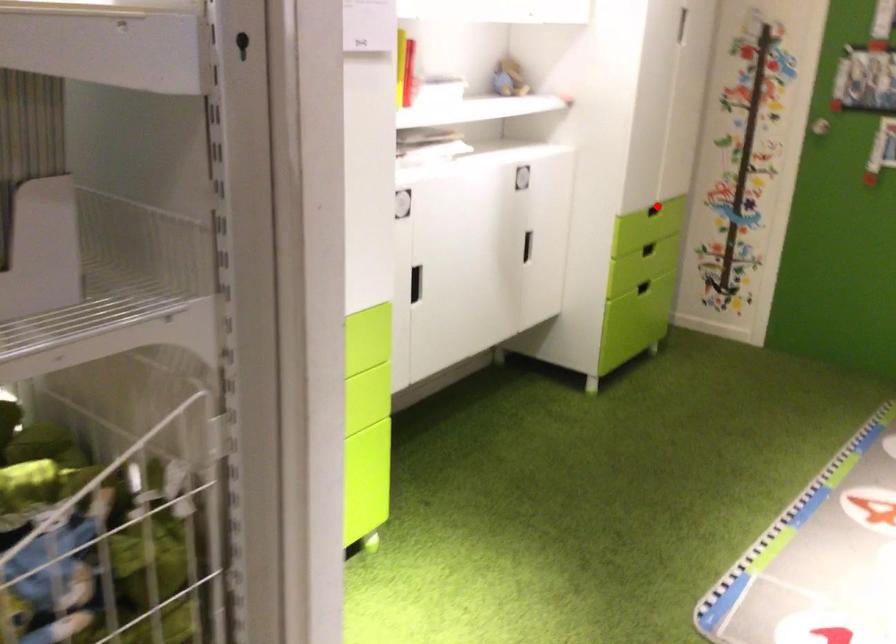
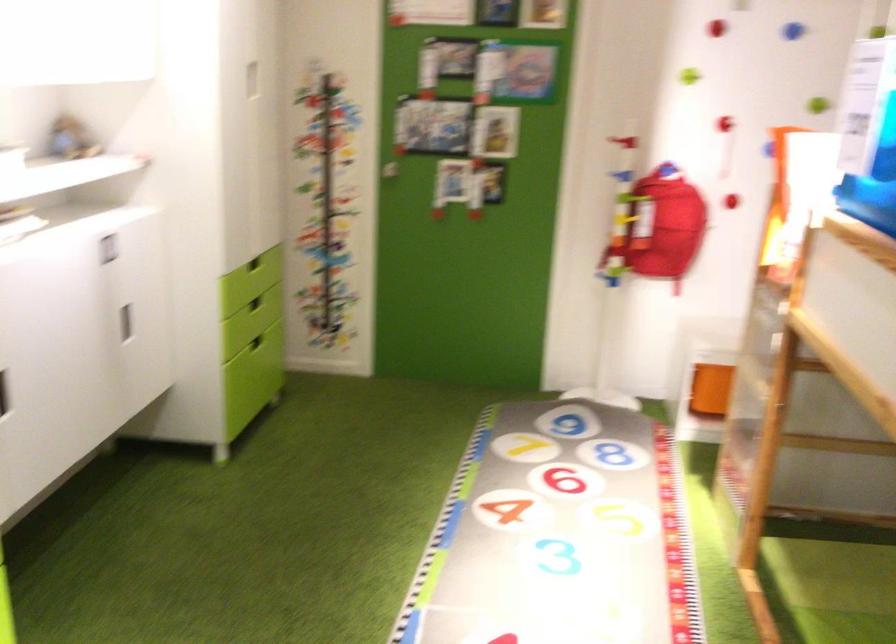
Find the pixel in the second image that matches the highlighted location in the first image.

(254, 263)